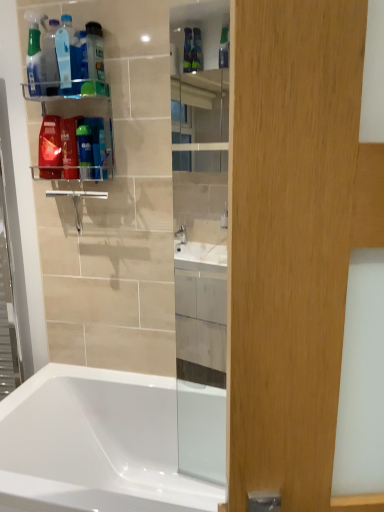
Identify the location of empty space that is ontop of clear plastic shelf at upper left. (64, 80).